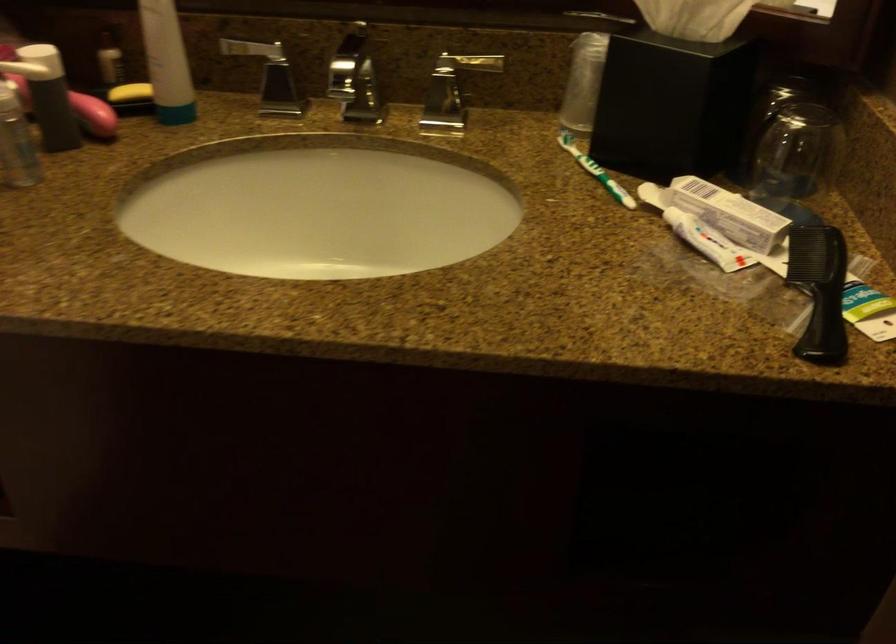
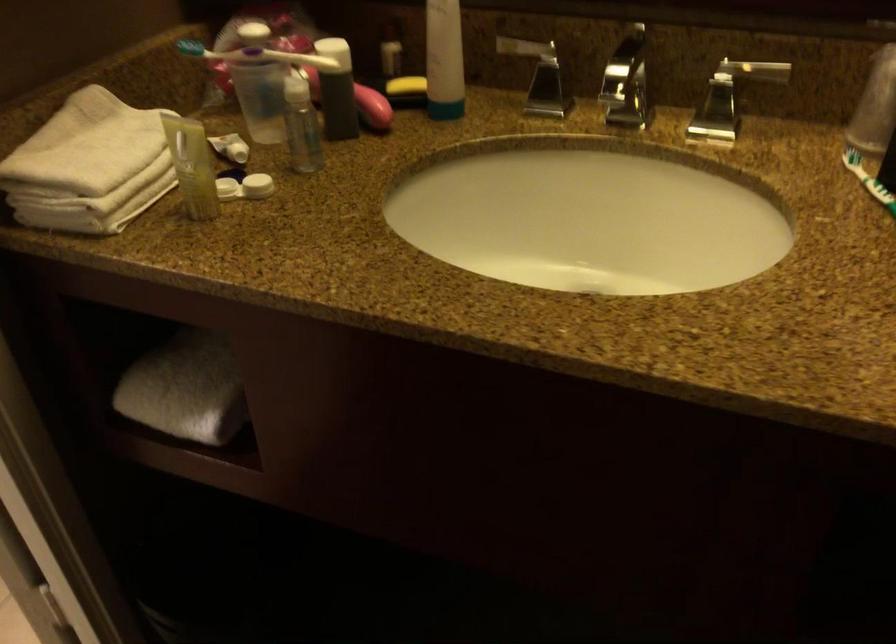
Question: Which direction would the cameraman need to move to produce the second image? Reply with the corresponding letter.

Choices:
 (A) Left
 (B) Right
 (C) Forward
 (D) Backward

Answer: (A)